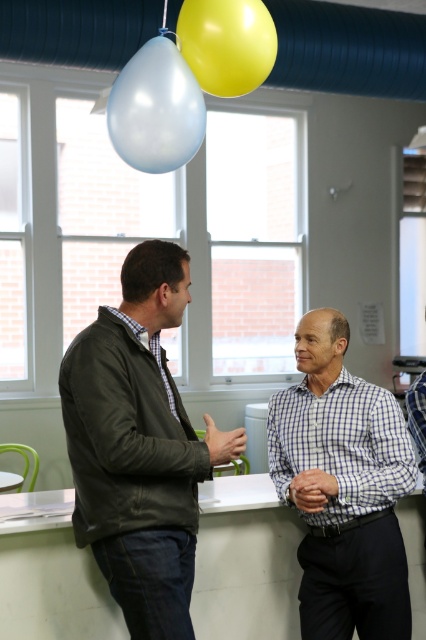
Question: Among these objects, which one is nearest to the camera?

Choices:
 (A) checkered shirt at center
 (B) leather jacket at left
 (C) yellow rubber balloon at upper center

Answer: (B)

Question: Considering the relative positions of checkered shirt at center and checkered fabric shirt at center in the image provided, where is checkered shirt at center located with respect to checkered fabric shirt at center?

Choices:
 (A) left
 (B) right

Answer: (A)

Question: Which point appears closest to the camera in this image?

Choices:
 (A) (140, 160)
 (B) (141, 307)
 (C) (328, 365)

Answer: (B)

Question: Which point is farther from the camera taking this photo?

Choices:
 (A) (115, 104)
 (B) (69, 362)
 (C) (411, 433)

Answer: (A)

Question: Is leather jacket at left thinner than checkered shirt at center?

Choices:
 (A) no
 (B) yes

Answer: (A)

Question: Can you confirm if checkered shirt at center is smaller than checkered fabric shirt at center?

Choices:
 (A) yes
 (B) no

Answer: (B)